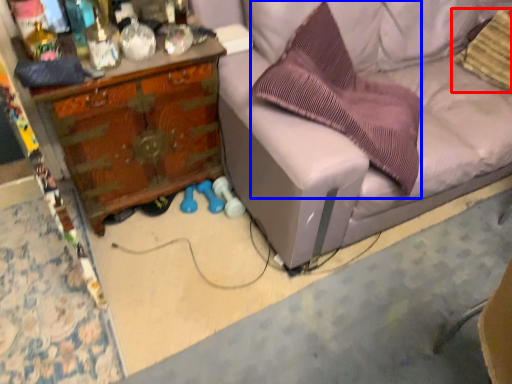
Question: Among these objects, which one is farthest to the camera, pillow (highlighted by a red box) or pillow (highlighted by a blue box)?

Choices:
 (A) pillow
 (B) pillow

Answer: (A)